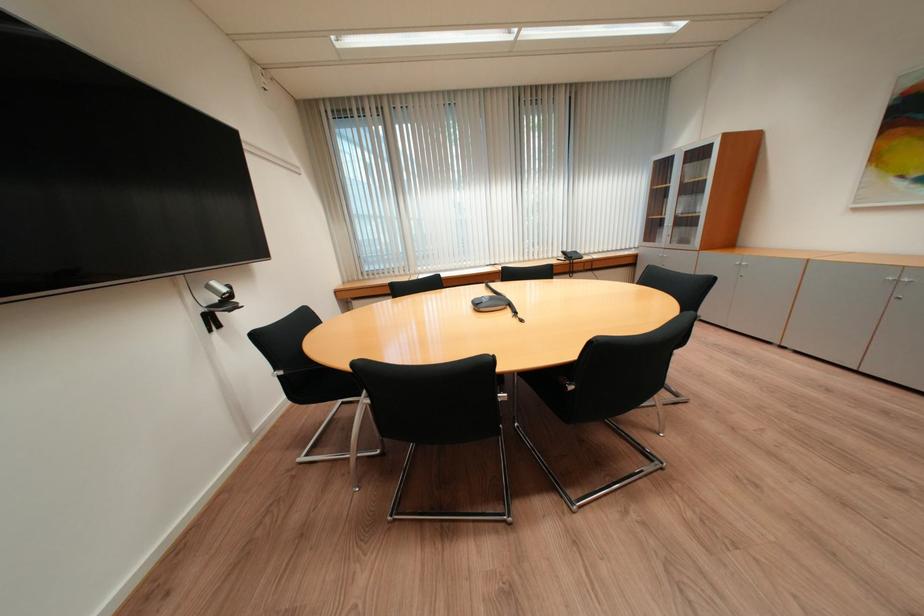
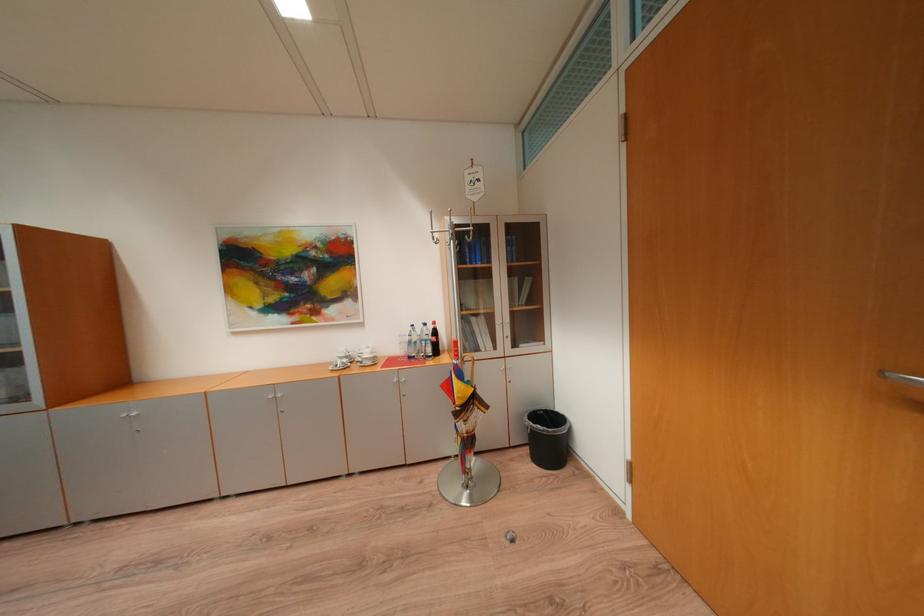
Question: How did the camera likely rotate?

Choices:
 (A) Left
 (B) Right
 (C) Up
 (D) Down

Answer: (B)